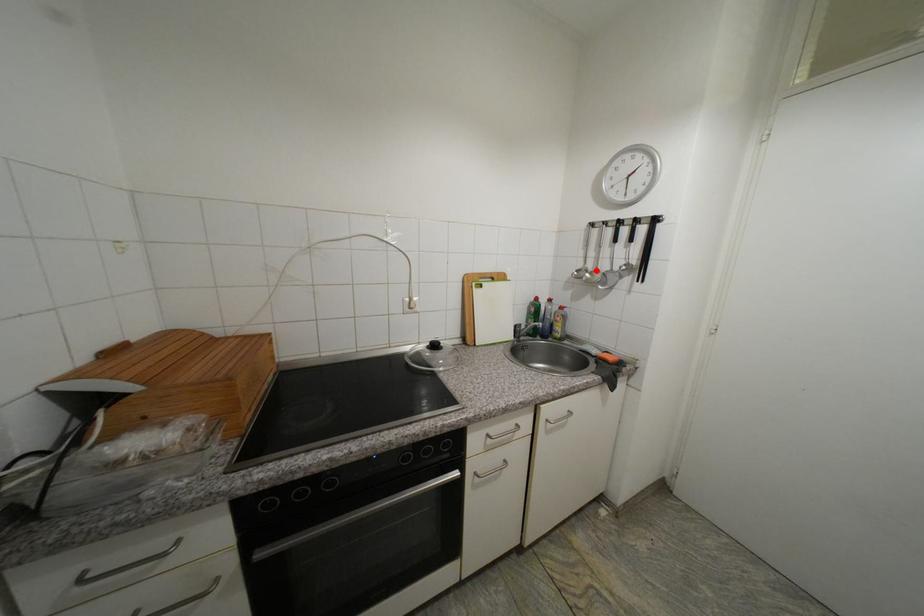
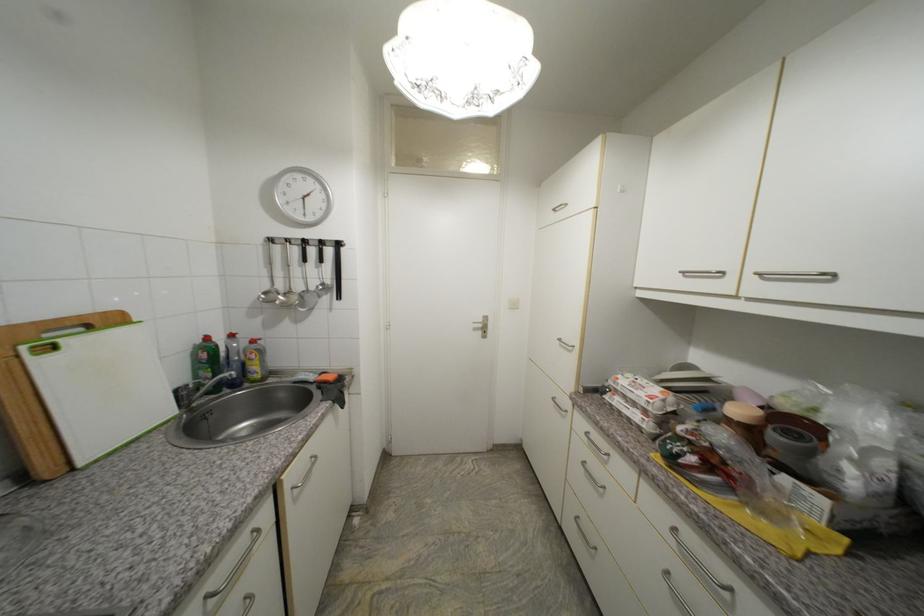
Locate, in the second image, the point that corresponds to the highlighted location in the first image.

(287, 292)